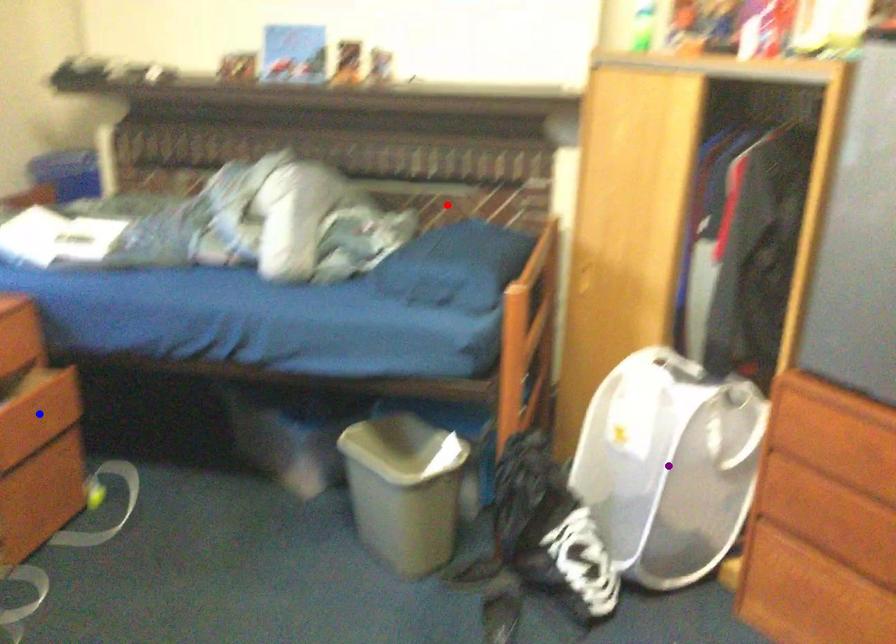
Based on the photo, order these from nearest to farthest:
A) blue point
B) purple point
C) red point

1. purple point
2. blue point
3. red point